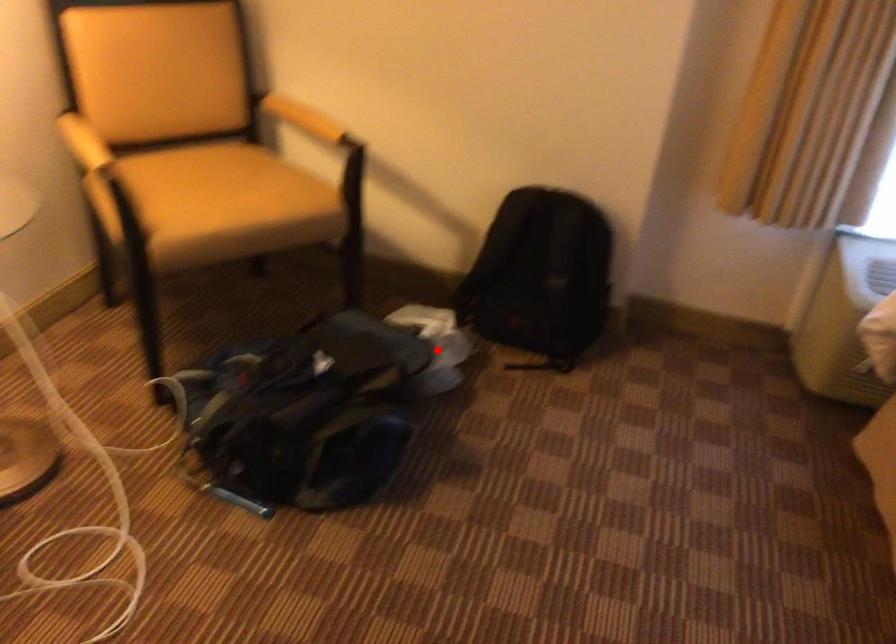
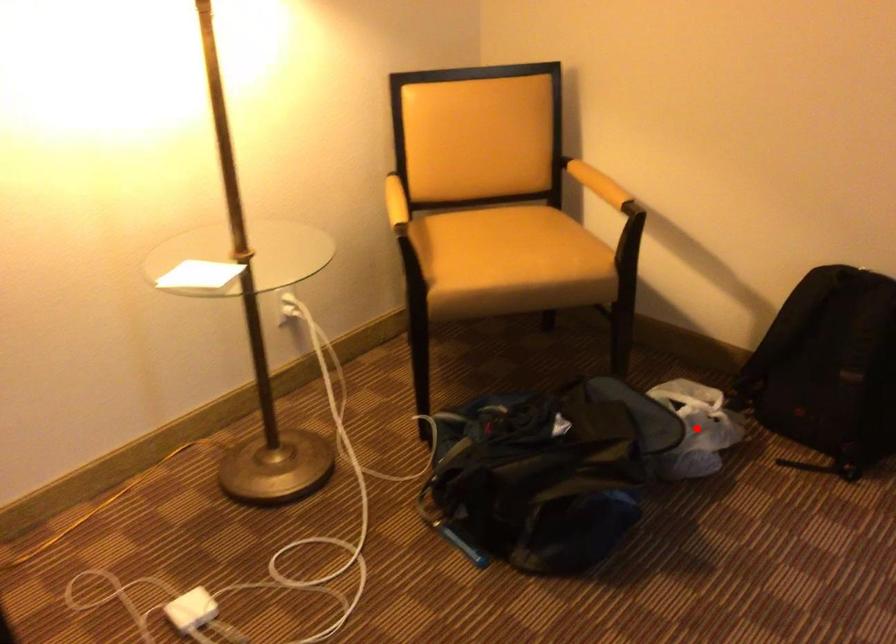
I am providing you with two images of the same scene from different viewpoints. A red point is marked on the first image and another point is marked on the second image. Does the point marked in image1 correspond to the same location as the one in image2?

Yes